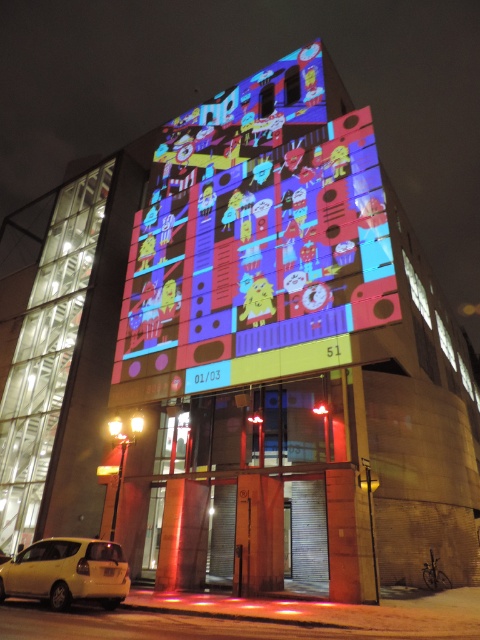
At what (x,y) coordinates should I click in order to perform the action: click on colorful digital art at center. Please return your answer as a coordinate pair (x, y). Looking at the image, I should click on (259, 227).

Describe the element at coordinates (259, 227) in the screenshot. I see `colorful digital art at center` at that location.

The width and height of the screenshot is (480, 640). Identify the location of colorful digital art at center. (259, 227).